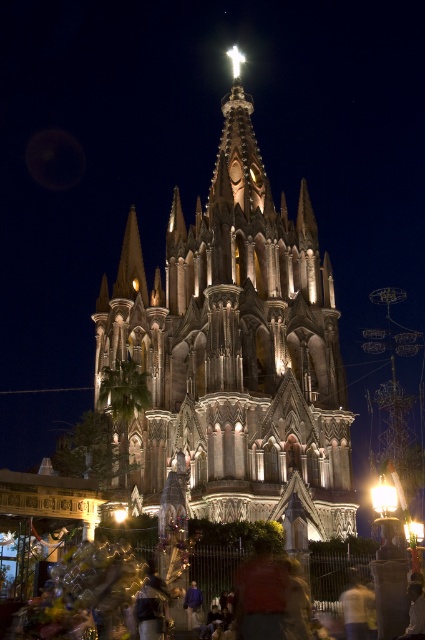
You are a photographer planning to capture the cathedral at night. You want to ensure that both the dark brown stone tower at center and the purple fabric at center are clearly visible in your photo. Based on their positions, which object should you focus on first to ensure both are in sharp focus?

The dark brown stone tower at center is located above the purple fabric at center. To ensure both are in sharp focus, you should focus on the dark brown stone tower at center first, as it is farther away and focusing on the farther object will naturally include the closer one in the depth of field.

A tour guide is standing at the base of the dark brown stone tower at center. They want to lead a group to the nearby gift shop, which is located at the same distance from the tower as the cross on the central spire. Is the gift shop closer to or farther from the tower than the gift shop?

The cross on the central spire is 62.63 meters away from the dark brown stone tower at center. Therefore, the gift shop, being at the same distance, is exactly 62.63 meters away from the tower, which is the same as the cross.

Based on the photo, you are standing in front of the cathedral and want to take a photo of the dark brown stone tower at center and the purple fabric at center. Which object should you focus on first to ensure both are in the frame?

You should focus on the dark brown stone tower at center first because it is closer to you than the purple fabric at center, so adjusting the camera to include it will naturally include the farther purple fabric at center as well.